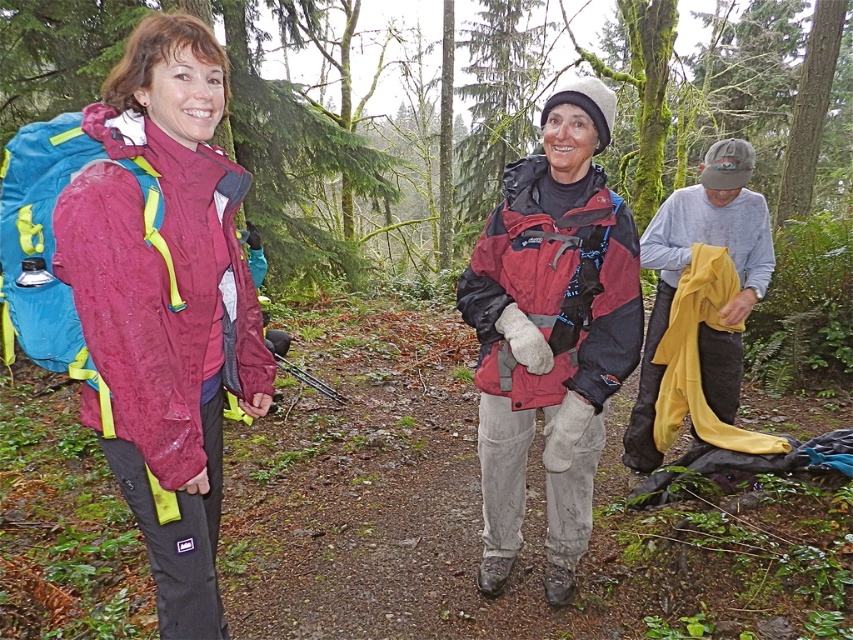
Question: Observing the image, what is the correct spatial positioning of wet matte jacket at left in reference to yellow fabric at right?

Choices:
 (A) above
 (B) below

Answer: (B)

Question: Among these points, which one is nearest to the camera?

Choices:
 (A) (706, 205)
 (B) (144, 259)

Answer: (B)

Question: Does reddish-brown waterproof jacket at center have a smaller size compared to yellow fabric at right?

Choices:
 (A) no
 (B) yes

Answer: (B)

Question: Is reddish-brown waterproof jacket at center below yellow fabric at right?

Choices:
 (A) no
 (B) yes

Answer: (B)

Question: Which object is farther from the camera taking this photo?

Choices:
 (A) wet matte jacket at left
 (B) reddish-brown waterproof jacket at center

Answer: (B)

Question: Which point is farther from the camera taking this photo?

Choices:
 (A) (738, 225)
 (B) (140, 118)
 (C) (540, 163)

Answer: (A)